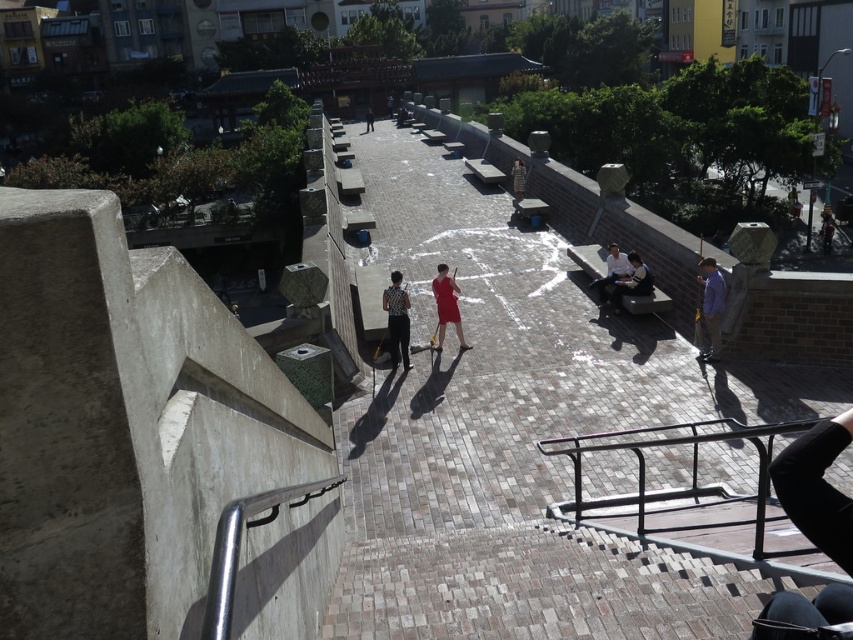
Based on the photo, which is more to the left, checkered shirt at center or matte red dress at center?

From the viewer's perspective, checkered shirt at center appears more on the left side.

Does checkered shirt at center appear on the right side of matte red dress at center?

Incorrect, checkered shirt at center is not on the right side of matte red dress at center.

Does point (408, 333) come behind point (456, 294)?

That is False.

Find the location of a particular element. Image resolution: width=853 pixels, height=640 pixels. checkered shirt at center is located at coordinates (397, 320).

Is black leather pants at lower right smaller than checkered shirt at center?

Yes, black leather pants at lower right is smaller than checkered shirt at center.

Who is more distant from viewer, (x=785, y=476) or (x=392, y=342)?

The point (x=392, y=342) is behind.

Identify the location of black leather pants at lower right. The height and width of the screenshot is (640, 853). (817, 488).

Is the position of silver metallic handrail at lower left less distant than that of dark gray suit at center?

Yes.

Based on the photo, does silver metallic handrail at lower left appear over dark gray suit at center?

No, silver metallic handrail at lower left is not above dark gray suit at center.

Is point (241, 502) less distant than point (637, 253)?

Yes, it is in front of point (637, 253).

You are a GUI agent. You are given a task and a screenshot of the screen. Output one action in this format:
    pyautogui.click(x=<x>, y=<y>)
    Task: Click on the silver metallic handrail at lower left
    The image size is (853, 640).
    Given the screenshot: What is the action you would take?
    pyautogui.click(x=239, y=548)